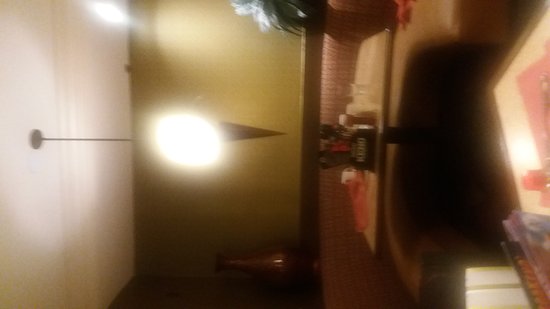
What are the coordinates of `plant` in the screenshot? It's located at (280, 8).